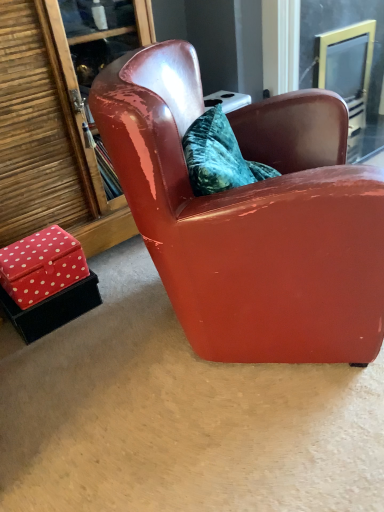
Question: Is the position of red velvet box at lower left, which is the 1th box in top-to-bottom order, more distant than that of clear glass screen door at upper right?

Choices:
 (A) no
 (B) yes

Answer: (A)

Question: From the image's perspective, is red velvet box at lower left, which is counted as the 2th box, starting from the bottom, on clear glass screen door at upper right?

Choices:
 (A) no
 (B) yes

Answer: (A)

Question: Can you confirm if red velvet box at lower left, which is the 1th box in top-to-bottom order, is positioned to the left of clear glass screen door at upper right?

Choices:
 (A) yes
 (B) no

Answer: (A)

Question: Considering the relative sizes of red velvet box at lower left, which is the 1th box in top-to-bottom order, and clear glass screen door at upper right in the image provided, is red velvet box at lower left, which is the 1th box in top-to-bottom order, smaller than clear glass screen door at upper right?

Choices:
 (A) no
 (B) yes

Answer: (B)

Question: Does red velvet box at lower left, which is the 1th box in top-to-bottom order, have a lesser width compared to clear glass screen door at upper right?

Choices:
 (A) no
 (B) yes

Answer: (B)

Question: Which is correct: glossy leather armchair at center is inside clear glass screen door at upper right, or outside of it?

Choices:
 (A) inside
 (B) outside

Answer: (B)

Question: From the image's perspective, is glossy leather armchair at center located above or below clear glass screen door at upper right?

Choices:
 (A) above
 (B) below

Answer: (B)

Question: From a real-world perspective, is glossy leather armchair at center positioned above or below clear glass screen door at upper right?

Choices:
 (A) above
 (B) below

Answer: (A)

Question: In the image, is glossy leather armchair at center positioned in front of or behind clear glass screen door at upper right?

Choices:
 (A) front
 (B) behind

Answer: (A)

Question: Looking at the image, does red polka dot fabric box at lower left, the 1th box ordered from the bottom, seem bigger or smaller compared to red velvet box at lower left, which is the 1th box in top-to-bottom order?

Choices:
 (A) small
 (B) big

Answer: (B)

Question: From a real-world perspective, is red polka dot fabric box at lower left, placed as the 2th box when sorted from top to bottom, physically located above or below red velvet box at lower left, which is counted as the 2th box, starting from the bottom?

Choices:
 (A) below
 (B) above

Answer: (A)

Question: Would you say red polka dot fabric box at lower left, placed as the 2th box when sorted from top to bottom, is inside or outside red velvet box at lower left, which is the 1th box in top-to-bottom order?

Choices:
 (A) outside
 (B) inside

Answer: (A)

Question: Considering the positions of red polka dot fabric box at lower left, placed as the 2th box when sorted from top to bottom, and red velvet box at lower left, which is the 1th box in top-to-bottom order, in the image, is red polka dot fabric box at lower left, placed as the 2th box when sorted from top to bottom, wider or thinner than red velvet box at lower left, which is the 1th box in top-to-bottom order,?

Choices:
 (A) thin
 (B) wide

Answer: (B)

Question: Considering the positions of red velvet box at lower left, which is the 1th box in top-to-bottom order, and glossy leather armchair at center in the image, is red velvet box at lower left, which is the 1th box in top-to-bottom order, wider or thinner than glossy leather armchair at center?

Choices:
 (A) thin
 (B) wide

Answer: (A)

Question: Is point (16, 260) closer or farther from the camera than point (370, 347)?

Choices:
 (A) farther
 (B) closer

Answer: (A)